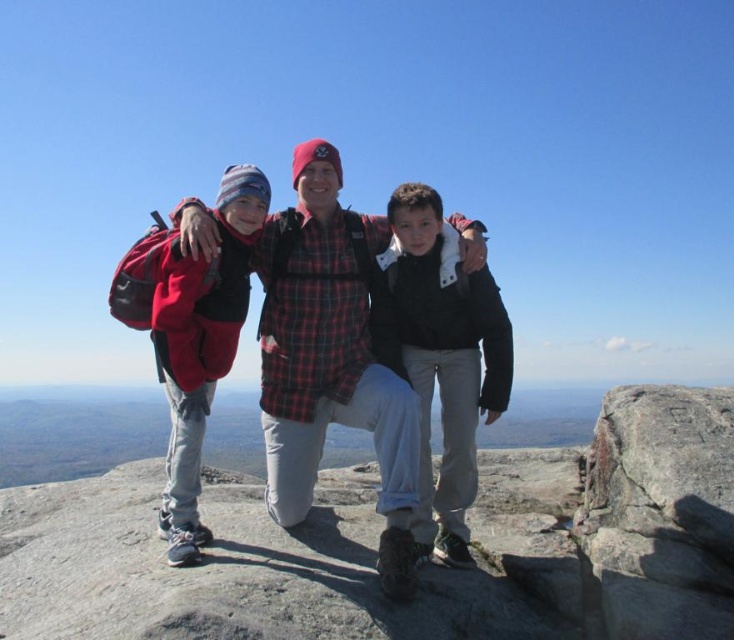
Question: Is plaid flannel shirt at center in front of red fleece jacket at left?

Choices:
 (A) no
 (B) yes

Answer: (B)

Question: Which object is the closest to the red fleece jacket at left?

Choices:
 (A) black matte jacket at center
 (B) gray granite rock at center
 (C) plaid flannel shirt at center

Answer: (C)

Question: Which of these objects is positioned closest to the plaid flannel shirt at center?

Choices:
 (A) red fleece jacket at left
 (B) black matte jacket at center
 (C) gray granite rock at center

Answer: (A)

Question: Considering the relative positions of gray granite rock at center and plaid flannel shirt at center in the image provided, where is gray granite rock at center located with respect to plaid flannel shirt at center?

Choices:
 (A) left
 (B) right

Answer: (B)

Question: Which of the following is the farthest from the observer?

Choices:
 (A) black matte jacket at center
 (B) gray granite rock at center

Answer: (A)

Question: Can you confirm if gray granite rock at center is positioned to the right of red fleece jacket at left?

Choices:
 (A) no
 (B) yes

Answer: (B)